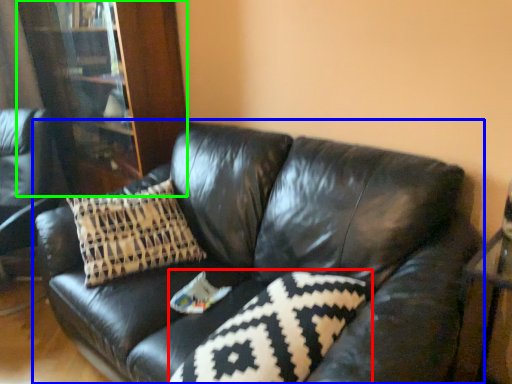
Question: Which is nearer to the pillow (highlighted by a red box)? studio couch (highlighted by a blue box) or bookcase (highlighted by a green box).

Choices:
 (A) studio couch
 (B) bookcase

Answer: (A)